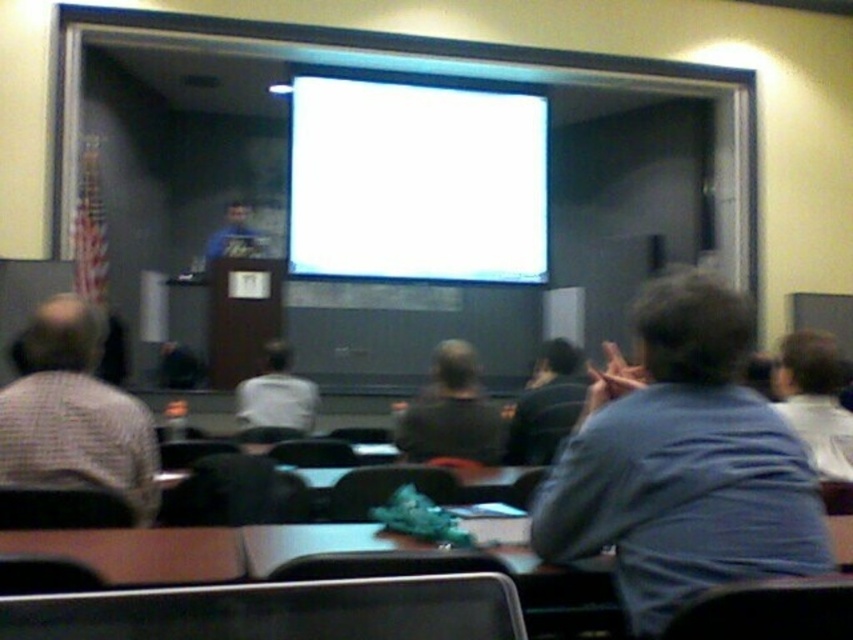
You are sitting in the classroom and want to see both the gray checkered shirt at left and the dark gray shirt at center clearly. Which one is positioned higher in the room?

The gray checkered shirt at left is located above the dark gray shirt at center, so it is positioned higher in the room.